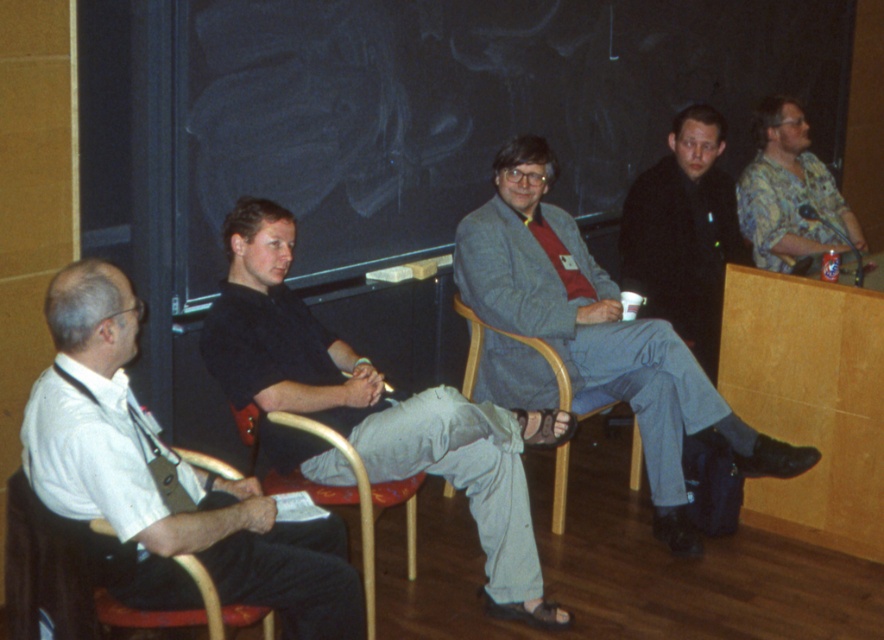
You are a photographer standing in the back of the classroom. You want to take a photo of the white shirt at left and the wooden chair at left. Which object is closer to you?

The white shirt at left is in front of the wooden chair at left, so the white shirt at left is closer to you.

What object is located at the coordinate point (90, 580) in the scene?

The wooden chair at left is located at the coordinate point (90, 580).